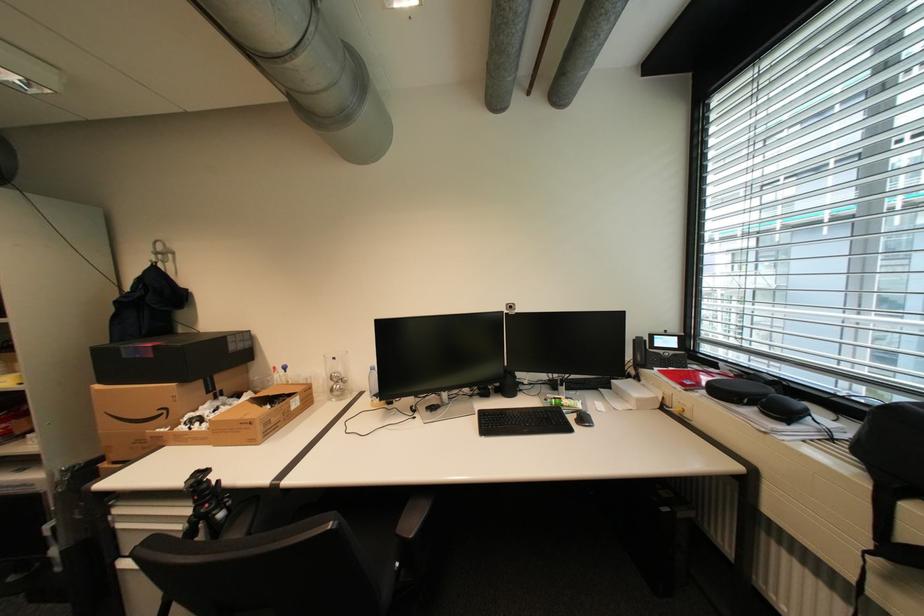
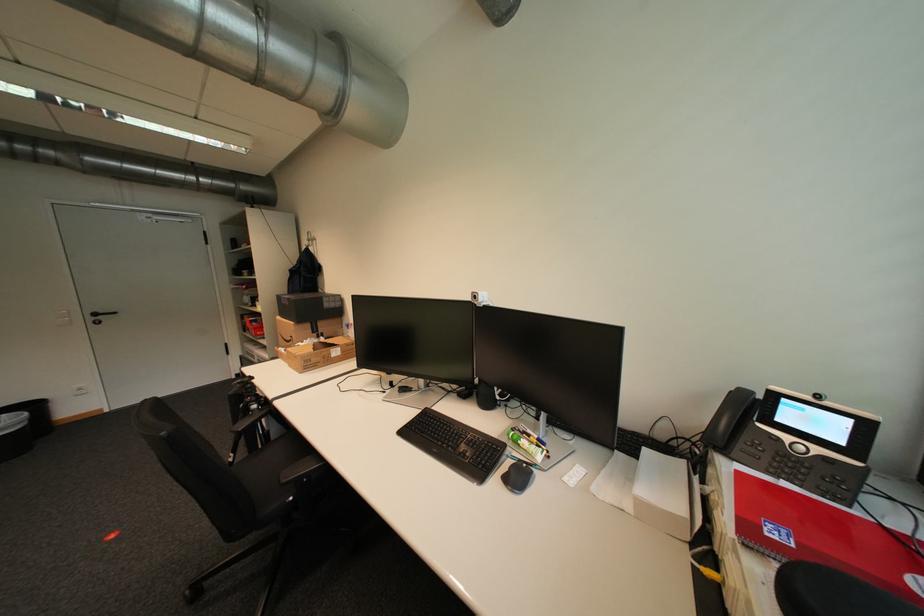
Question: The camera is either moving clockwise (left) or counter-clockwise (right) around the object. The first image is from the beginning of the video and the second image is from the end. Is the camera moving left or right when shooting the video?

Choices:
 (A) Left
 (B) Right

Answer: (B)